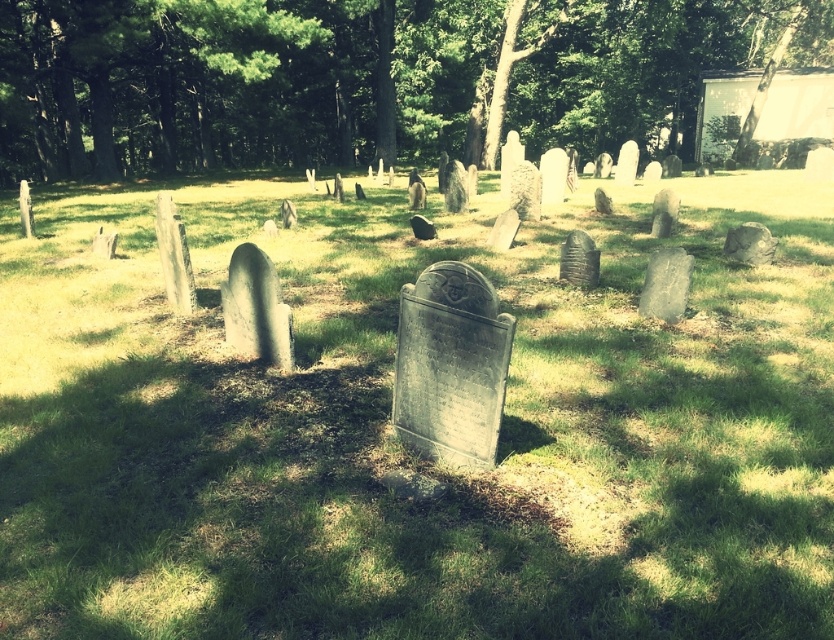
Question: Does green grassy at center have a smaller size compared to green leafy tree at upper center?

Choices:
 (A) yes
 (B) no

Answer: (A)

Question: Which object is farther from the camera taking this photo?

Choices:
 (A) green leafy tree at upper center
 (B) green grassy at center

Answer: (A)

Question: Which point appears closest to the camera in this image?

Choices:
 (A) (49, 520)
 (B) (91, 10)

Answer: (A)

Question: Is green grassy at center above green leafy tree at upper center?

Choices:
 (A) no
 (B) yes

Answer: (A)

Question: In this image, where is green grassy at center located relative to green leafy tree at upper center?

Choices:
 (A) right
 (B) left

Answer: (B)